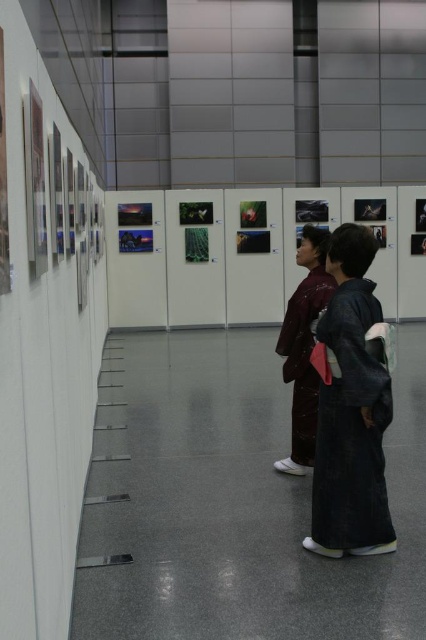
Question: Which of the following is the farthest from the observer?

Choices:
 (A) (351, 424)
 (B) (307, 356)

Answer: (B)

Question: Can you confirm if dark gray kimono at center is bigger than matte brown kimono at center?

Choices:
 (A) no
 (B) yes

Answer: (A)

Question: Is dark gray kimono at center below matte brown kimono at center?

Choices:
 (A) no
 (B) yes

Answer: (B)

Question: Is dark gray kimono at center further to camera compared to matte brown kimono at center?

Choices:
 (A) no
 (B) yes

Answer: (A)

Question: Which of the following is the farthest from the observer?

Choices:
 (A) tap(307, 324)
 (B) tap(376, 387)

Answer: (A)